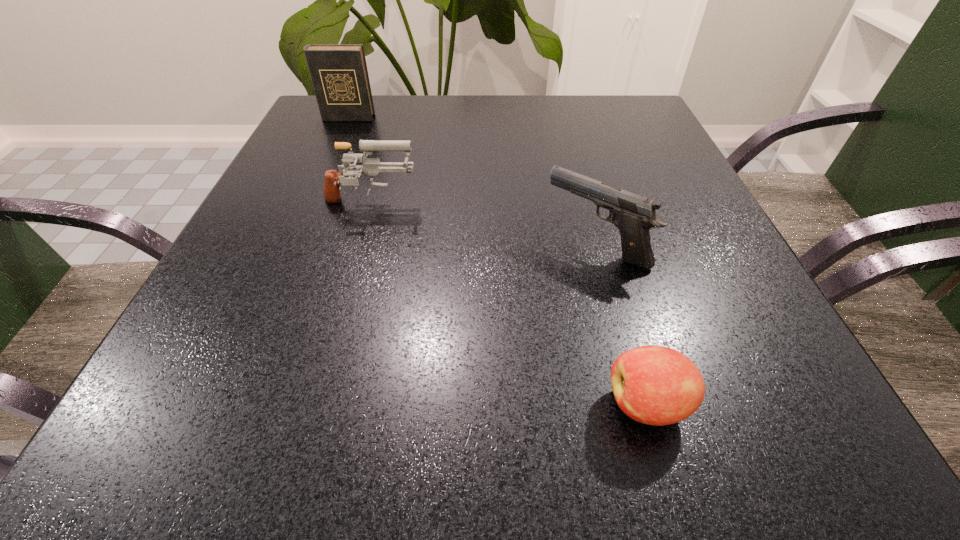
Find the location of a particular element. Image resolution: width=960 pixels, height=540 pixels. free space that satisfies the following two spatial constraints: 1. at the barrel end of the left gun; 2. on the left side of the apple is located at coordinates (314, 404).

Where is `vacant point that satisfies the following two spatial constraints: 1. at the barrel end of the apple; 2. on the right side of the left gun`? vacant point that satisfies the following two spatial constraints: 1. at the barrel end of the apple; 2. on the right side of the left gun is located at coordinates (314, 404).

You are a GUI agent. You are given a task and a screenshot of the screen. Output one action in this format:
    pyautogui.click(x=<x>, y=<y>)
    Task: Click on the vacant position in the image that satisfies the following two spatial constraints: 1. at the barrel end of the left gun; 2. on the right side of the shortest object
    
    Given the screenshot: What is the action you would take?
    pyautogui.click(x=314, y=404)